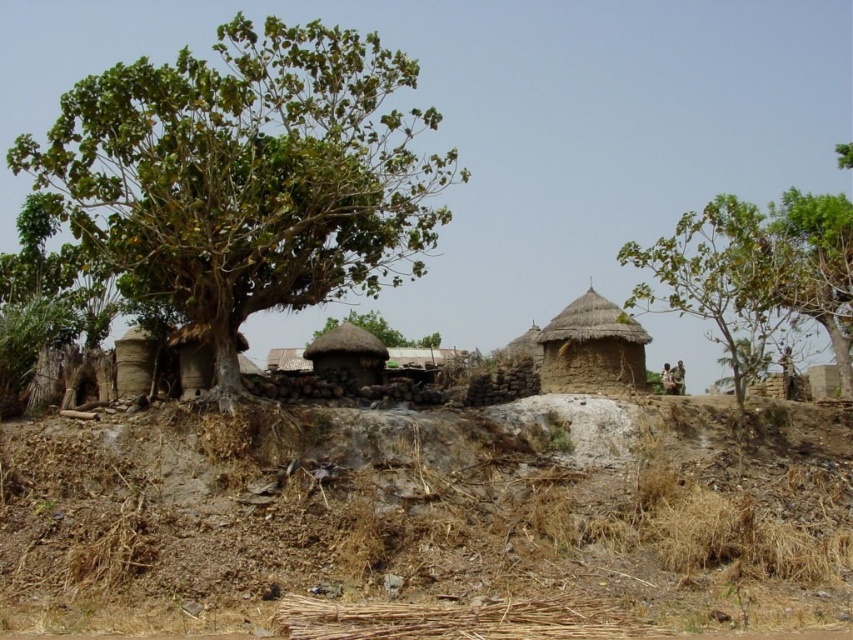
You are standing at the point with coordinates [590,348] in the image. What object is located exactly at this point?

The thatched straw hut at center is located exactly at point [590,348].

You are standing in the rural village scene and want to find the thatched straw hut at center. Based on the thatched brown hut at center, which direction should you look to locate it?

The thatched straw hut at center is to the right of the thatched brown hut at center, so you should look to the right of the thatched brown hut at center to find it.

You are planning to plant a new tree in the village. The green leafy tree at left and the thatched brown hut at center are both in the area. Considering their widths, which one is wider?

The green leafy tree at left is wider than the thatched brown hut at center because its width surpasses the hut.